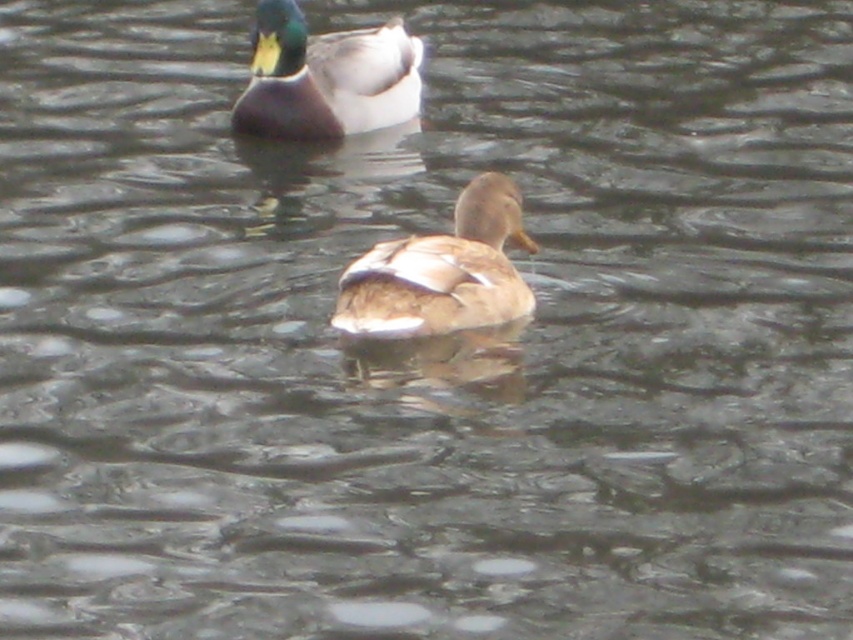
The width and height of the screenshot is (853, 640). What do you see at coordinates (442, 272) in the screenshot? I see `brown matte duck at center` at bounding box center [442, 272].

Which is above, brown matte duck at center or shiny green and brown duck at upper center?

shiny green and brown duck at upper center is above.

Does point (422, 248) come farther from viewer compared to point (332, 134)?

No, (422, 248) is closer to viewer.

You are a GUI agent. You are given a task and a screenshot of the screen. Output one action in this format:
    pyautogui.click(x=<x>, y=<y>)
    Task: Click on the brown matte duck at center
    
    Given the screenshot: What is the action you would take?
    pyautogui.click(x=442, y=272)